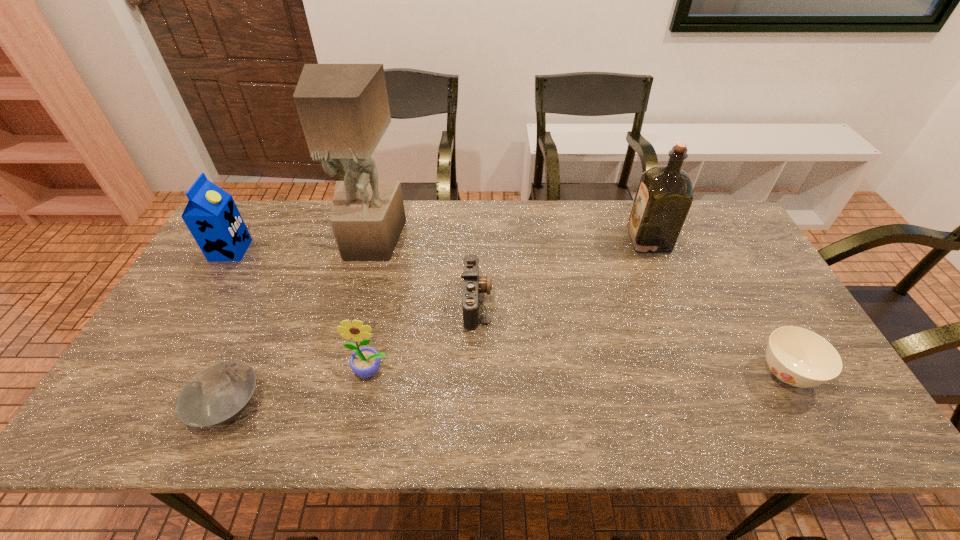
Locate an element on the screen. Image resolution: width=960 pixels, height=540 pixels. free space at the right edge of the desktop is located at coordinates (768, 299).

Where is `vacant region at the far left corner`? The image size is (960, 540). vacant region at the far left corner is located at coordinates (267, 219).

The height and width of the screenshot is (540, 960). I want to click on vacant region at the near right corner, so click(x=810, y=404).

The image size is (960, 540). What are the coordinates of `free space between the sugar bowl and the tallest object` in the screenshot? It's located at click(x=578, y=307).

Find the location of a particular element. empty space between the sunflower and the tallest object is located at coordinates (372, 306).

This screenshot has height=540, width=960. Find the location of `free space that is in between the shortest object and the sculpture`. free space that is in between the shortest object and the sculpture is located at coordinates (x=300, y=323).

You are a GUI agent. You are given a task and a screenshot of the screen. Output one action in this format:
    pyautogui.click(x=<x>, y=<y>)
    Task: Click on the free space between the liquor and the sculpture
    The width and height of the screenshot is (960, 540).
    Given the screenshot: What is the action you would take?
    pyautogui.click(x=510, y=240)

Image resolution: width=960 pixels, height=540 pixels. I want to click on free spot between the sugar bowl and the third tallest object, so click(x=508, y=312).

The height and width of the screenshot is (540, 960). Find the location of `free spot between the rightmost object and the second object from right to left`. free spot between the rightmost object and the second object from right to left is located at coordinates (717, 307).

Locate an element on the screen. The image size is (960, 540). vacant space in between the sixth object from left to right and the tallest object is located at coordinates 510,240.